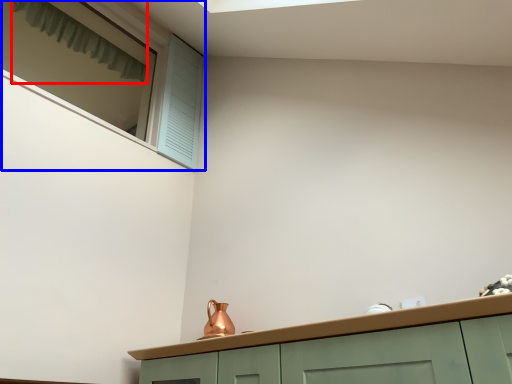
Question: Which object appears farthest to the camera in this image, curtain (highlighted by a red box) or window (highlighted by a blue box)?

Choices:
 (A) curtain
 (B) window

Answer: (A)